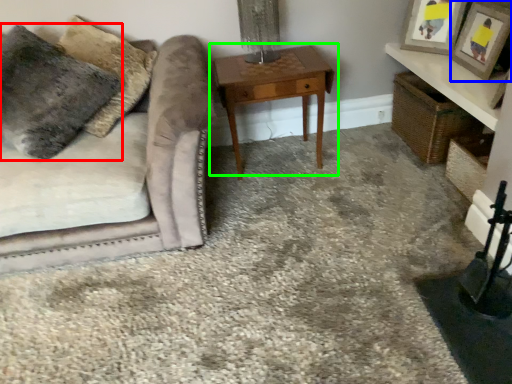
Question: Which object is the closest to the pillow (highlighted by a red box)? Choose among these: picture frame (highlighted by a blue box) or table (highlighted by a green box).

Choices:
 (A) picture frame
 (B) table

Answer: (B)